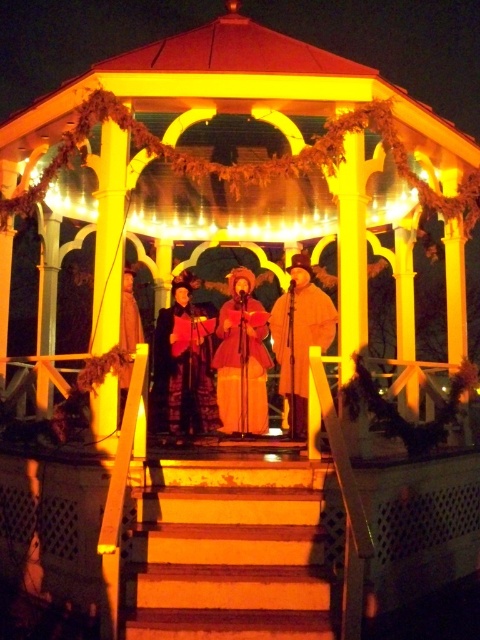
Question: Is wooden stairs at center to the right of velvet red dress at center from the viewer's perspective?

Choices:
 (A) no
 (B) yes

Answer: (B)

Question: Which of these objects is positioned closest to the velvet red coat at center?

Choices:
 (A) yellow wood gazebo at center
 (B) matte pink coat at center
 (C) matte brown coat at center

Answer: (B)

Question: Which object is closer to the camera taking this photo?

Choices:
 (A) matte brown coat at center
 (B) velvet red coat at center
 (C) matte pink coat at center
 (D) wooden stairs at center

Answer: (D)

Question: Can you confirm if velvet red dress at center is positioned above velvet red coat at center?

Choices:
 (A) no
 (B) yes

Answer: (A)

Question: Which of the following is the closest to the observer?

Choices:
 (A) (267, 58)
 (B) (299, 348)

Answer: (A)

Question: Can you confirm if yellow wood gazebo at center is wider than velvet red coat at center?

Choices:
 (A) yes
 (B) no

Answer: (A)